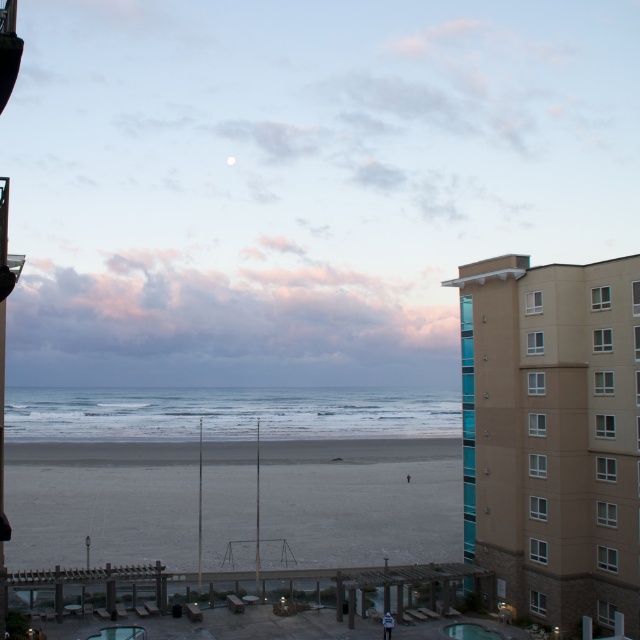
You are a guest staying at the beachfront resort and want to walk from your room to the beach. You see the gray sand at center and the transparent glass pool at lower center. Which one is closer to the beach?

The transparent glass pool at lower center is closer to the beach than the gray sand at center because it is positioned lower in the image, which typically corresponds to being nearer to the viewer or the beach in such scenes.

In the scene shown: You are designing a postcard and want to highlight both the matte blue sky at upper center and the smooth concrete pool at center. Since the postcard has limited space, which of these two elements should you prioritize to ensure it fits properly?

The smooth concrete pool at center should be prioritized because the matte blue sky at upper center has a larger width, so it might not fit well in the limited space of the postcard.